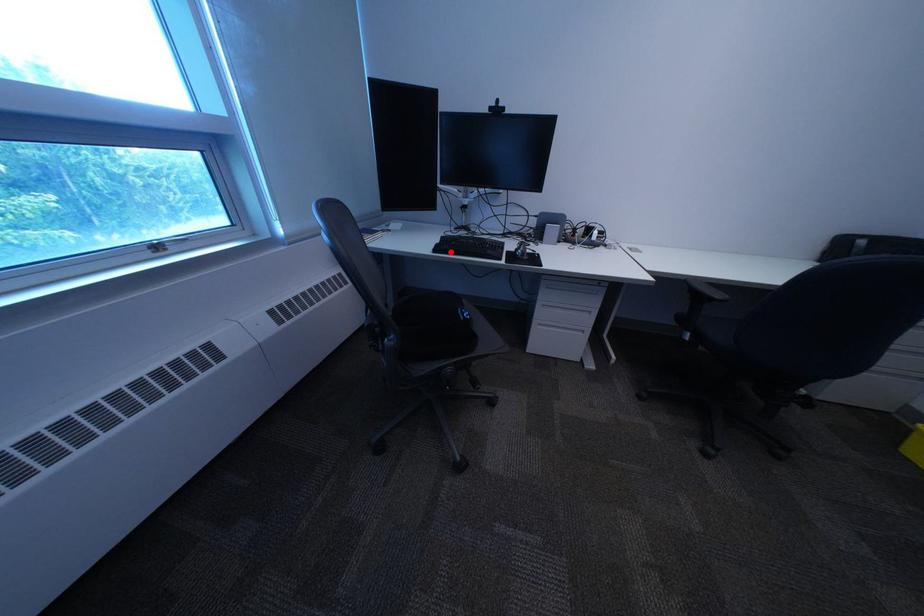
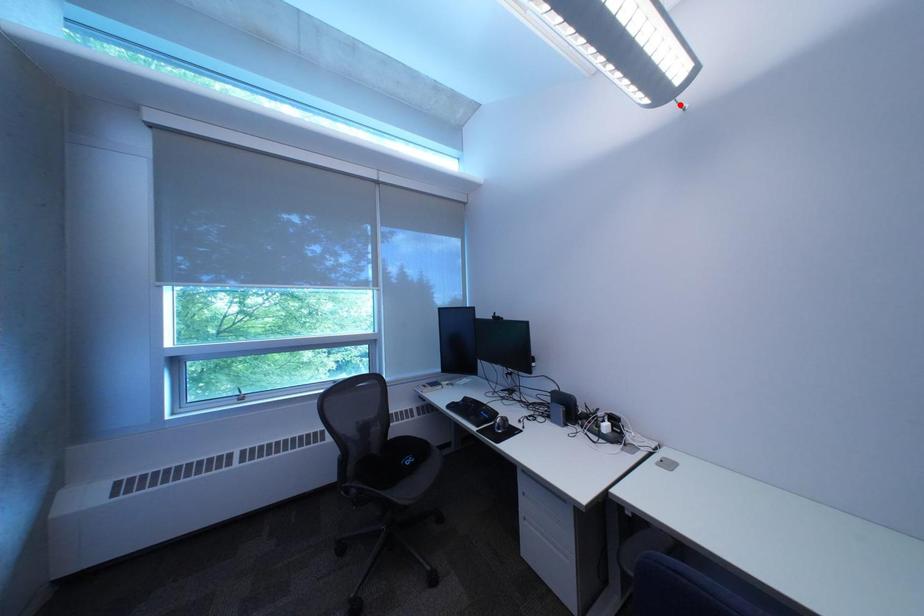
I am providing you with two images of the same scene from different viewpoints. A red point is marked on the first image and another point is marked on the second image. Are the points marked in image1 and image2 representing the same 3D position?

No